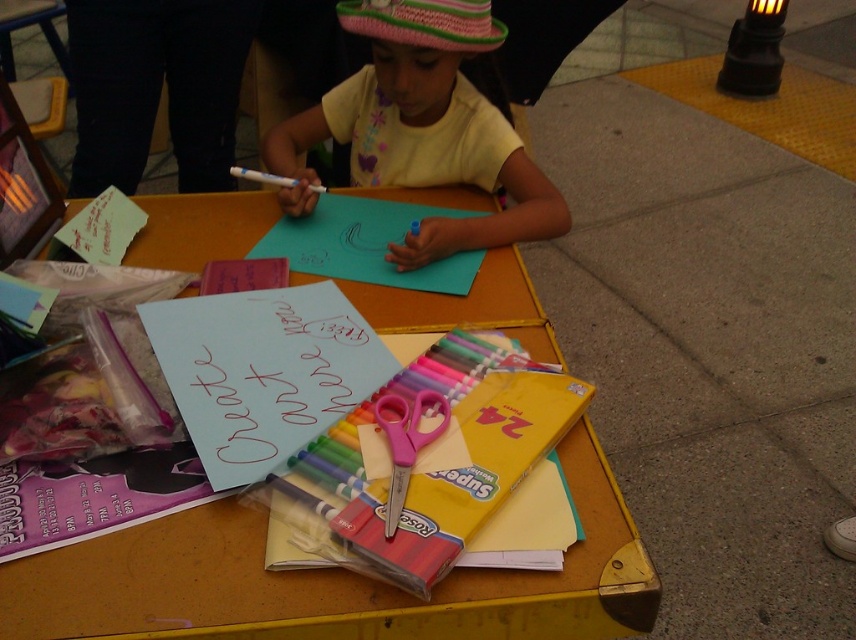
Consider the image. Can you confirm if yellow cardboard table at center is smaller than white matte marker at center?

Actually, yellow cardboard table at center might be larger than white matte marker at center.

From the picture: Is yellow cardboard table at center below white matte marker at center?

Yes.

The height and width of the screenshot is (640, 856). I want to click on yellow cardboard table at center, so click(x=330, y=582).

Which is above, yellow cardboard table at center or yellow cotton shirt at center?

yellow cotton shirt at center is above.

Is point (421, 317) positioned before point (465, 8)?

Yes, point (421, 317) is closer to viewer.

Which is behind, point (339, 632) or point (378, 177)?

Point (378, 177)

Find the location of `yellow cardboard table at center`. yellow cardboard table at center is located at coordinates (330, 582).

Which of these two, yellow cotton shirt at center or pink plastic scissors at center, stands taller?

With more height is yellow cotton shirt at center.

From the picture: Can you confirm if yellow cotton shirt at center is wider than pink plastic scissors at center?

Yes.

Where is `yellow cotton shirt at center`? The image size is (856, 640). yellow cotton shirt at center is located at coordinates (424, 125).

In order to click on yellow cotton shirt at center in this screenshot , I will do `click(424, 125)`.